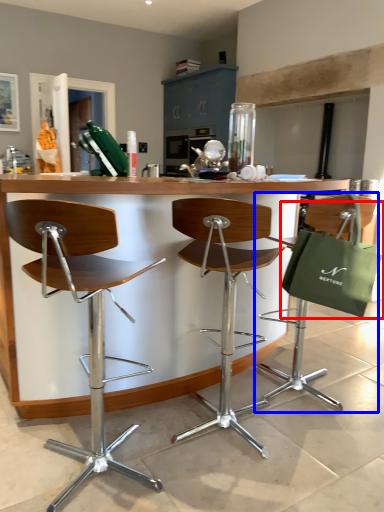
Question: Which point is further to the camera, shopping bag (highlighted by a red box) or chair (highlighted by a blue box)?

Choices:
 (A) shopping bag
 (B) chair

Answer: (B)